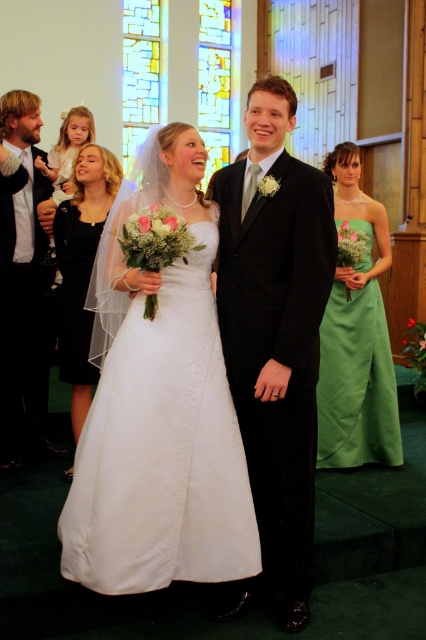
Is white satin dress at center taller than shiny black suit at left?

Incorrect, white satin dress at center's height is not larger of shiny black suit at left's.

Is white satin dress at center bigger than shiny black suit at left?

Yes.

This screenshot has width=426, height=640. What do you see at coordinates (158, 406) in the screenshot?
I see `white satin dress at center` at bounding box center [158, 406].

In order to click on white satin dress at center in this screenshot , I will do `click(158, 406)`.

Between white satin dress at center and green satin dress at center, which one is positioned higher?

green satin dress at center

You are a GUI agent. You are given a task and a screenshot of the screen. Output one action in this format:
    pyautogui.click(x=<x>, y=<y>)
    Task: Click on the white satin dress at center
    
    Given the screenshot: What is the action you would take?
    pyautogui.click(x=158, y=406)

Where is `white satin dress at center`? white satin dress at center is located at coordinates (158, 406).

At what (x,y) coordinates should I click in order to perform the action: click on white satin dress at center. Please return your answer as a coordinate pair (x, y). This screenshot has width=426, height=640. Looking at the image, I should click on (158, 406).

Measure the distance between white satin dress at center and camera.

They are 7.17 feet apart.

Is point (198, 316) more distant than point (71, 356)?

No, it is not.

This screenshot has width=426, height=640. Identify the location of white satin dress at center. (158, 406).